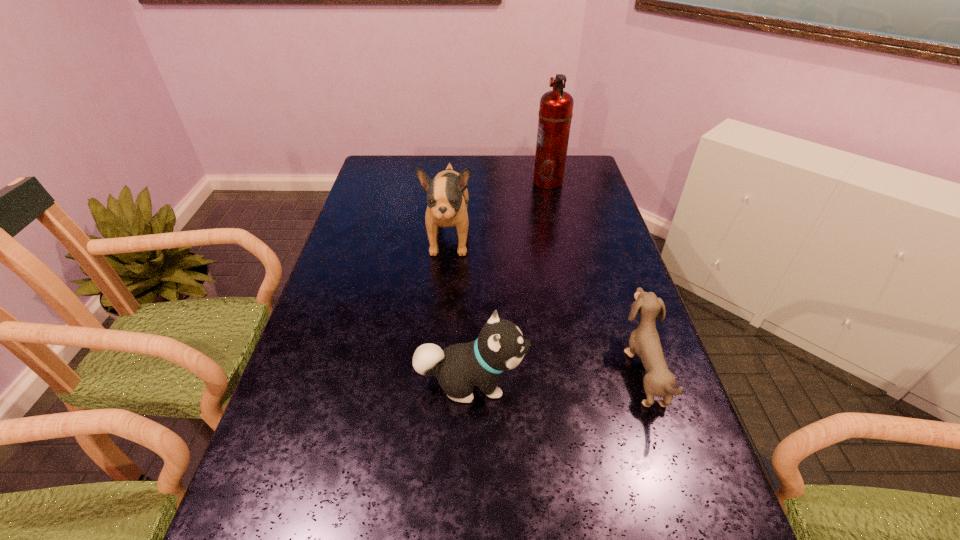
Select which object appears as the second closest to the shortest puppy. Please provide its 2D coordinates. Your answer should be formatted as a tuple, i.e. [(x, y)], where the tuple contains the x and y coordinates of a point satisfying the conditions above.

[(447, 196)]

Select which puppy appears as the second closest to the second tallest object. Please provide its 2D coordinates. Your answer should be formatted as a tuple, i.e. [(x, y)], where the tuple contains the x and y coordinates of a point satisfying the conditions above.

[(644, 341)]

The width and height of the screenshot is (960, 540). Identify the location of puppy that can be found as the closest to the second object from right to left. (447, 196).

The width and height of the screenshot is (960, 540). What are the coordinates of `vacant space that satisfies the following two spatial constraints: 1. on the nozzle side of the fire extinguisher; 2. at the face of the second farthest object` in the screenshot? It's located at (561, 238).

This screenshot has width=960, height=540. In order to click on free location that satisfies the following two spatial constraints: 1. on the nozzle side of the farthest object; 2. at the face of the tallest puppy in this screenshot , I will do `click(561, 238)`.